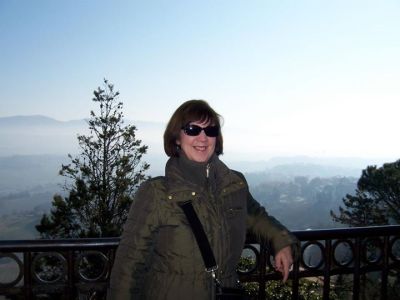
Image resolution: width=400 pixels, height=300 pixels. I want to click on coat, so click(x=189, y=241).